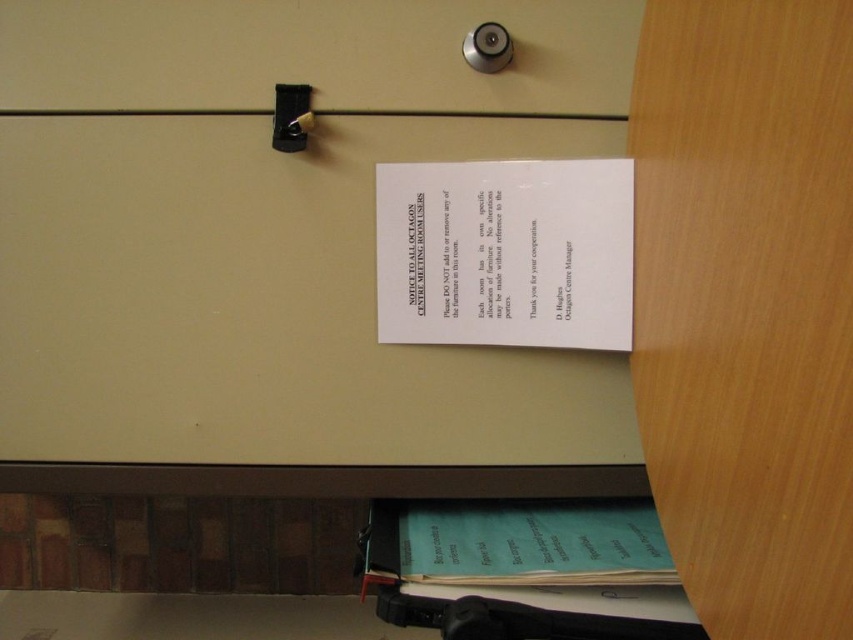
Is matte plastic drawer at upper center to the right of white paper at center from the viewer's perspective?

Incorrect, matte plastic drawer at upper center is not on the right side of white paper at center.

Is point (157, 26) farther from viewer compared to point (490, 332)?

No, (157, 26) is in front of (490, 332).

Measure the distance between matte plastic drawer at upper center and camera.

A distance of 26.63 inches exists between matte plastic drawer at upper center and camera.

You are a GUI agent. You are given a task and a screenshot of the screen. Output one action in this format:
    pyautogui.click(x=<x>, y=<y>)
    Task: Click on the matte plastic drawer at upper center
    
    Given the screenshot: What is the action you would take?
    pyautogui.click(x=312, y=54)